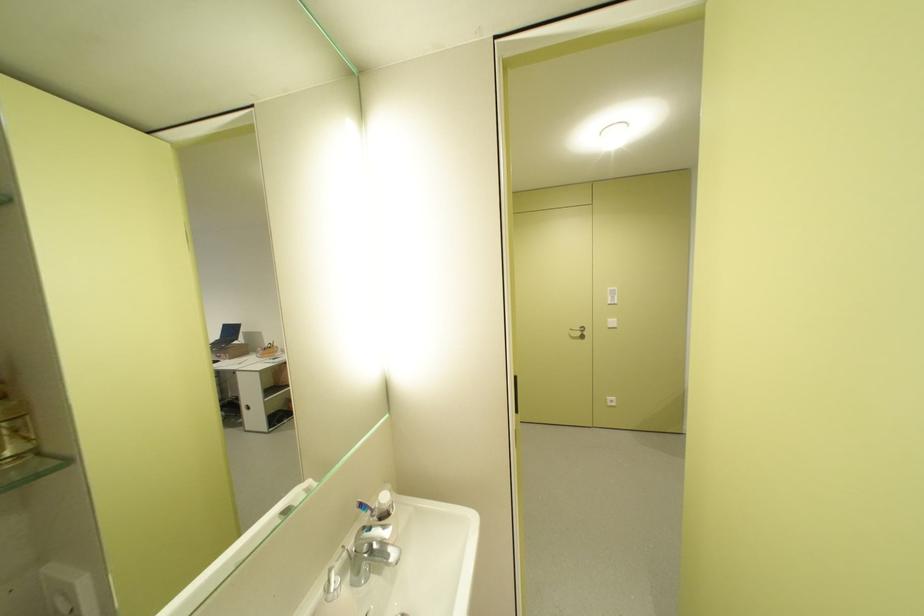
The width and height of the screenshot is (924, 616). What do you see at coordinates (332, 585) in the screenshot?
I see `a sink drain control` at bounding box center [332, 585].